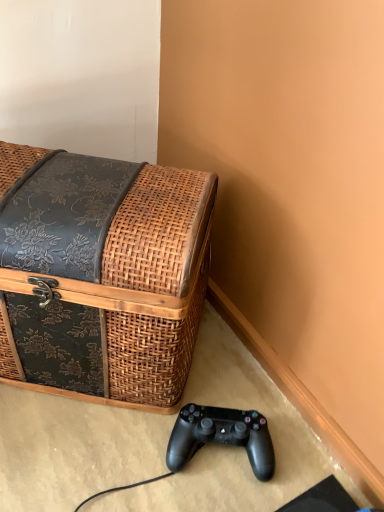
Where is `free space between black matte game controller at lower center and woven wood trunk at left`? This screenshot has width=384, height=512. free space between black matte game controller at lower center and woven wood trunk at left is located at coordinates (147, 428).